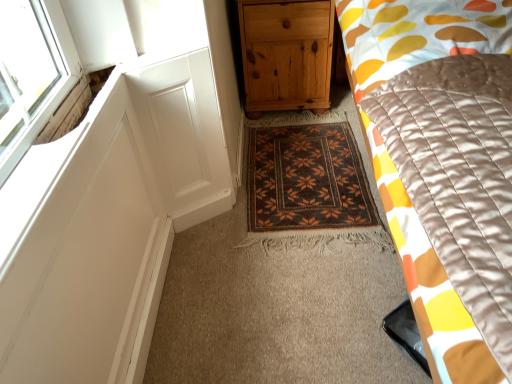
Question: From a real-world perspective, is natural wood chest of drawers at center positioned over silky yellow-orange quilt at right based on gravity?

Choices:
 (A) no
 (B) yes

Answer: (A)

Question: Is natural wood chest of drawers at center not near silky yellow-orange quilt at right?

Choices:
 (A) yes
 (B) no

Answer: (B)

Question: Is natural wood chest of drawers at center with silky yellow-orange quilt at right?

Choices:
 (A) yes
 (B) no

Answer: (B)

Question: Is natural wood chest of drawers at center in front of silky yellow-orange quilt at right?

Choices:
 (A) yes
 (B) no

Answer: (B)

Question: From a real-world perspective, is natural wood chest of drawers at center positioned under silky yellow-orange quilt at right based on gravity?

Choices:
 (A) no
 (B) yes

Answer: (B)

Question: From a real-world perspective, relative to natural wood chest of drawers at center, is silky yellow-orange quilt at right vertically above or below?

Choices:
 (A) above
 (B) below

Answer: (A)

Question: Considering the positions of silky yellow-orange quilt at right and natural wood chest of drawers at center in the image, is silky yellow-orange quilt at right bigger or smaller than natural wood chest of drawers at center?

Choices:
 (A) small
 (B) big

Answer: (B)

Question: From the image's perspective, relative to natural wood chest of drawers at center, is silky yellow-orange quilt at right above or below?

Choices:
 (A) below
 (B) above

Answer: (A)

Question: Is point (458, 241) positioned closer to the camera than point (262, 76)?

Choices:
 (A) farther
 (B) closer

Answer: (B)

Question: In the image, is brown woven mat at center positioned in front of or behind silky yellow-orange quilt at right?

Choices:
 (A) behind
 (B) front

Answer: (A)

Question: From a real-world perspective, is brown woven mat at center physically located above or below silky yellow-orange quilt at right?

Choices:
 (A) below
 (B) above

Answer: (A)

Question: Considering the relative positions of brown woven mat at center and silky yellow-orange quilt at right in the image provided, is brown woven mat at center to the left or to the right of silky yellow-orange quilt at right?

Choices:
 (A) right
 (B) left

Answer: (B)

Question: Is point (327, 157) positioned closer to the camera than point (415, 56)?

Choices:
 (A) farther
 (B) closer

Answer: (A)

Question: From the image's perspective, is natural wood chest of drawers at center above or below silky yellow-orange quilt at right?

Choices:
 (A) below
 (B) above

Answer: (B)

Question: Considering the positions of point (266, 74) and point (429, 273), is point (266, 74) closer or farther from the camera than point (429, 273)?

Choices:
 (A) farther
 (B) closer

Answer: (A)